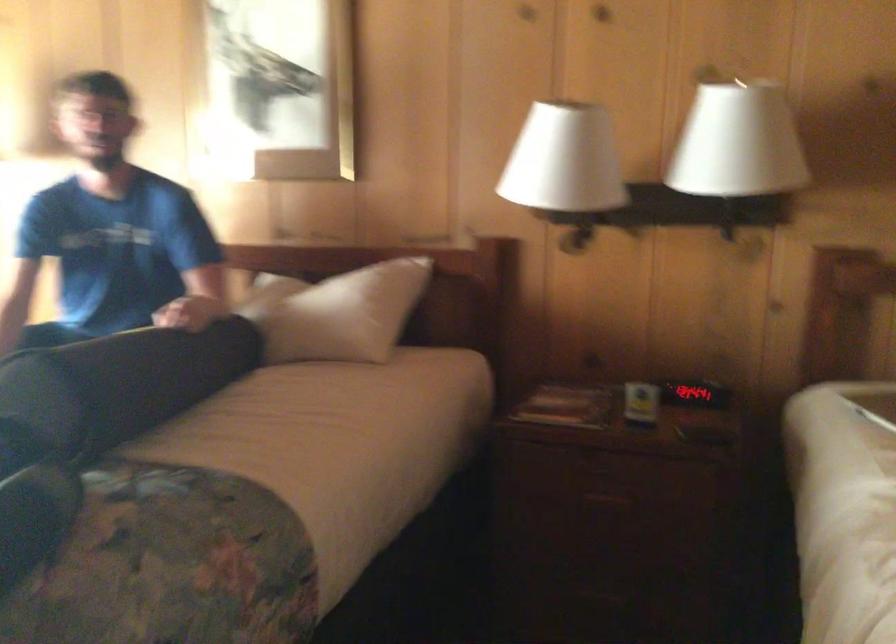
Find the location of `digital alarm clock`. digital alarm clock is located at coordinates (694, 393).